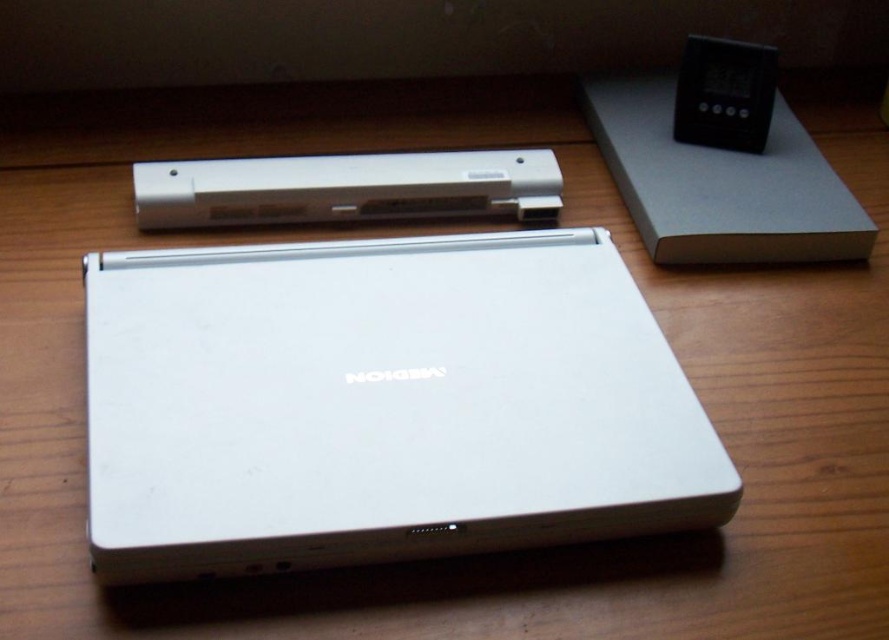
Does white matte laptop at center appear on the left side of black plastic ipod at upper right?

Correct, you'll find white matte laptop at center to the left of black plastic ipod at upper right.

Who is higher up, white matte laptop at center or black plastic ipod at upper right?

black plastic ipod at upper right is above.

Locate an element on the screen. Image resolution: width=889 pixels, height=640 pixels. white matte laptop at center is located at coordinates (382, 404).

Between point (270, 157) and point (746, 116), which one is positioned in front?

Positioned in front is point (270, 157).

Does point (314, 216) come behind point (721, 93)?

No, it is in front of (721, 93).

Where is `white plastic speaker at upper center`? white plastic speaker at upper center is located at coordinates (347, 188).

Can you confirm if white matte laptop at center is positioned to the left of white plastic speaker at upper center?

Incorrect, white matte laptop at center is not on the left side of white plastic speaker at upper center.

Which is in front, point (622, 317) or point (337, 189)?

Positioned in front is point (622, 317).

This screenshot has height=640, width=889. What do you see at coordinates (382, 404) in the screenshot? I see `white matte laptop at center` at bounding box center [382, 404].

Identify the location of white matte laptop at center. (382, 404).